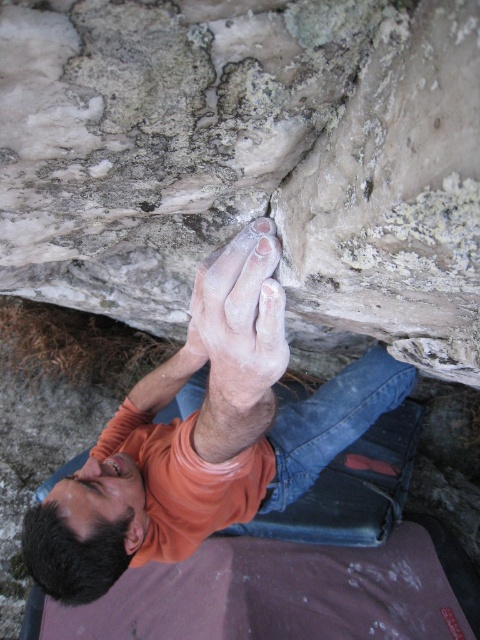
Question: Based on their relative distances, which object is farther from the smooth gray rock at center?

Choices:
 (A) dry skin at upper center
 (B) white powdery hand at center

Answer: (A)

Question: Is smooth gray rock at center to the left of dry skin at upper center from the viewer's perspective?

Choices:
 (A) no
 (B) yes

Answer: (A)

Question: In this image, where is smooth gray rock at center located relative to white powdery hand at center?

Choices:
 (A) left
 (B) right

Answer: (B)

Question: Which is nearer to the dry skin at upper center?

Choices:
 (A) white powdery hand at center
 (B) smooth gray rock at center

Answer: (A)

Question: Among these points, which one is farthest from the camera?

Choices:
 (A) (253, 92)
 (B) (239, 410)
 (C) (106, 582)

Answer: (C)

Question: Is dry skin at upper center above white powdery hand at center?

Choices:
 (A) no
 (B) yes

Answer: (A)